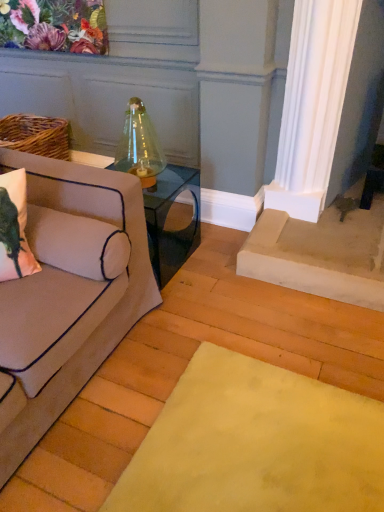
Find the location of a particular element. The height and width of the screenshot is (512, 384). vacant space to the right of clear glass table at center is located at coordinates (213, 261).